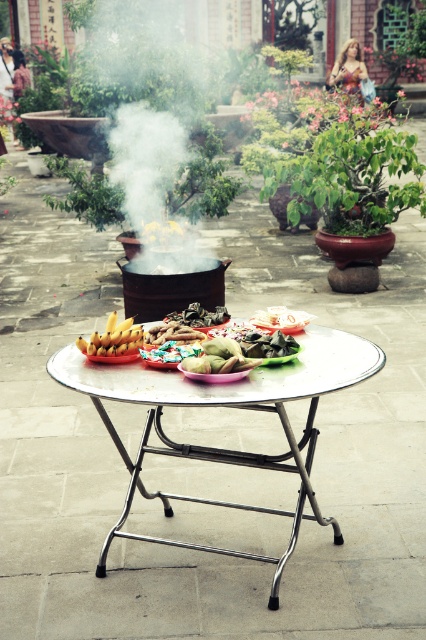
Describe the element at coordinates (258, 340) in the screenshot. I see `green matte food at center` at that location.

Identify the location of green matte food at center. This screenshot has width=426, height=640. (258, 340).

Is matte brown paper at center thinner than shiny metallic candy at center?

Incorrect, matte brown paper at center's width is not less than shiny metallic candy at center's.

Is matte brown paper at center positioned in front of shiny metallic candy at center?

No, it is behind shiny metallic candy at center.

In order to click on matte brown paper at center in this screenshot , I will do `click(281, 317)`.

Which is more to the right, metallic silver table at center or green matte vegetable at center?

metallic silver table at center

From the picture: Which of these two, metallic silver table at center or green matte vegetable at center, stands taller?

metallic silver table at center

What do you see at coordinates (226, 406) in the screenshot? The image size is (426, 640). I see `metallic silver table at center` at bounding box center [226, 406].

Where is `metallic silver table at center`? metallic silver table at center is located at coordinates (226, 406).